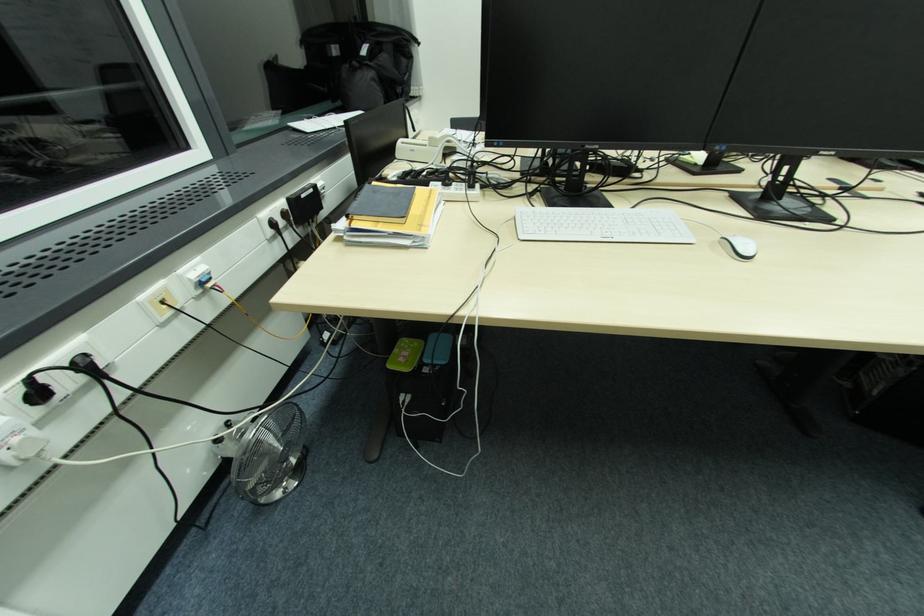
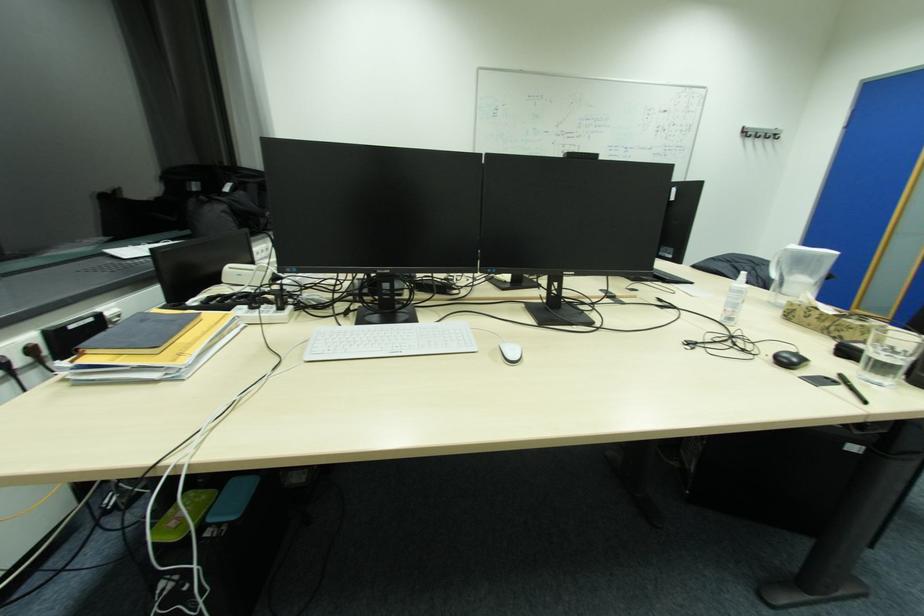
Question: Based on the continuous images, in which direction is the camera rotating? Reply with the corresponding letter.

Choices:
 (A) Left
 (B) Right
 (C) Up
 (D) Down

Answer: (C)